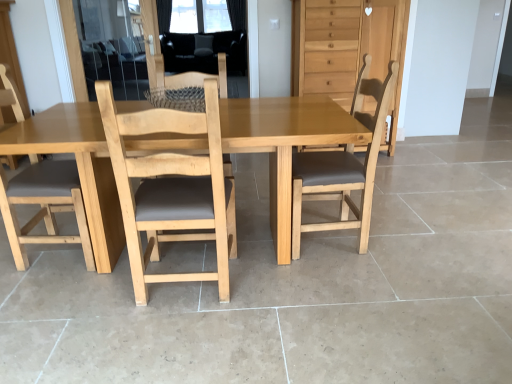
Question: Is light brown wood chair at left, positioned as the 2th chair in left-to-right order, to the left of light brown wood chair at center, which is the 4th chair in left-to-right order, from the viewer's perspective?

Choices:
 (A) no
 (B) yes

Answer: (B)

Question: Is light brown wood chair at left, positioned as the 2th chair in left-to-right order, bigger than light brown wood chair at center, which ranks as the 1th chair in right-to-left order?

Choices:
 (A) no
 (B) yes

Answer: (B)

Question: Can you confirm if light brown wood chair at left, positioned as the 2th chair in left-to-right order, is wider than light brown wood chair at center, which ranks as the 1th chair in right-to-left order?

Choices:
 (A) no
 (B) yes

Answer: (A)

Question: Is light brown wood chair at left, which is the third chair from right to left, facing away from light brown wood chair at center, which is the 4th chair in left-to-right order?

Choices:
 (A) yes
 (B) no

Answer: (B)

Question: Is light brown wood chair at left, which is the third chair from right to left, oriented towards light brown wood chair at center, which ranks as the 1th chair in right-to-left order?

Choices:
 (A) no
 (B) yes

Answer: (B)

Question: Is light brown wood chair at left, the 1th chair in the left-to-right sequence, taller or shorter than light brown wood chair at left, positioned as the 2th chair in left-to-right order?

Choices:
 (A) short
 (B) tall

Answer: (B)

Question: Looking at the image, does light brown wood chair at left, the 1th chair in the left-to-right sequence, seem bigger or smaller compared to light brown wood chair at left, which is the third chair from right to left?

Choices:
 (A) small
 (B) big

Answer: (B)

Question: From the image's perspective, is light brown wood chair at left, acting as the fourth chair starting from the right, located above or below light brown wood chair at left, which is the third chair from right to left?

Choices:
 (A) above
 (B) below

Answer: (A)

Question: In the image, is light brown wood chair at left, acting as the fourth chair starting from the right, positioned in front of or behind light brown wood chair at left, which is the third chair from right to left?

Choices:
 (A) front
 (B) behind

Answer: (B)

Question: Do you think light brown wooden dresser at upper right is within light brown wood chair at left, which is the third chair from right to left, or outside of it?

Choices:
 (A) inside
 (B) outside

Answer: (B)

Question: Looking at the image, does light brown wooden dresser at upper right seem bigger or smaller compared to light brown wood chair at left, which is the third chair from right to left?

Choices:
 (A) big
 (B) small

Answer: (A)

Question: Looking at their shapes, would you say light brown wooden dresser at upper right is wider or thinner than light brown wood chair at left, which is the third chair from right to left?

Choices:
 (A) wide
 (B) thin

Answer: (A)

Question: Is light brown wooden dresser at upper right taller or shorter than light brown wood chair at left, which is the third chair from right to left?

Choices:
 (A) tall
 (B) short

Answer: (A)

Question: Based on their positions, is light brown wood chair at left, positioned as the 2th chair in left-to-right order, located to the left or right of transparent glass screen door at upper left?

Choices:
 (A) right
 (B) left

Answer: (A)

Question: From the image's perspective, relative to transparent glass screen door at upper left, is light brown wood chair at left, which is the third chair from right to left, above or below?

Choices:
 (A) above
 (B) below

Answer: (B)